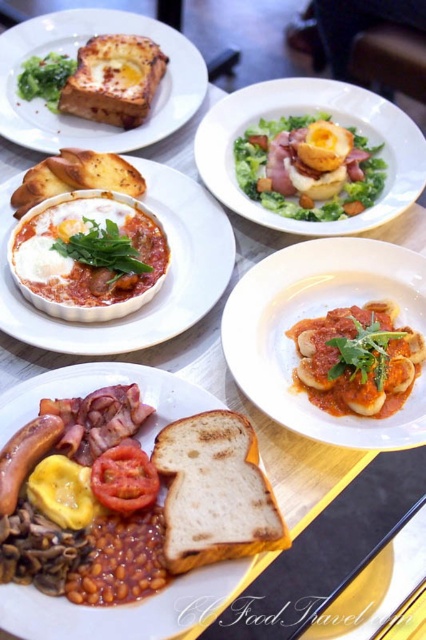
You are a customer at a breakfast buffet and want to choose between the golden brown toasted bread at upper left and the red matte tomato at center. Based on their positions, which one is located higher up in the image?

The golden brown toasted bread at upper left is located higher up in the image than the red matte tomato at center.

You are a chef arranging a breakfast buffet. You have two items to place on a shelf that can only hold items up to 10 cm in height. The golden brown toasted bread at upper left and the red matte tomato at center are both available. Which item can safely be placed on the shelf without exceeding the height limit?

The red matte tomato at center can safely be placed on the shelf since the golden brown toasted bread at upper left is much taller and would exceed the 10 cm height limit.

You are a chef arranging a buffet table. You have two items to place on the table, the white bread at center and the red matte tomato at center. The minimum distance required between items on the buffet is 10 centimeters. Can you place them at the specified positions without violating the distance rule?

The white bread at center is 11.55 centimeters from the red matte tomato at center, which exceeds the minimum required distance of 10 centimeters. Therefore, they can be placed at the specified positions without violating the distance rule.